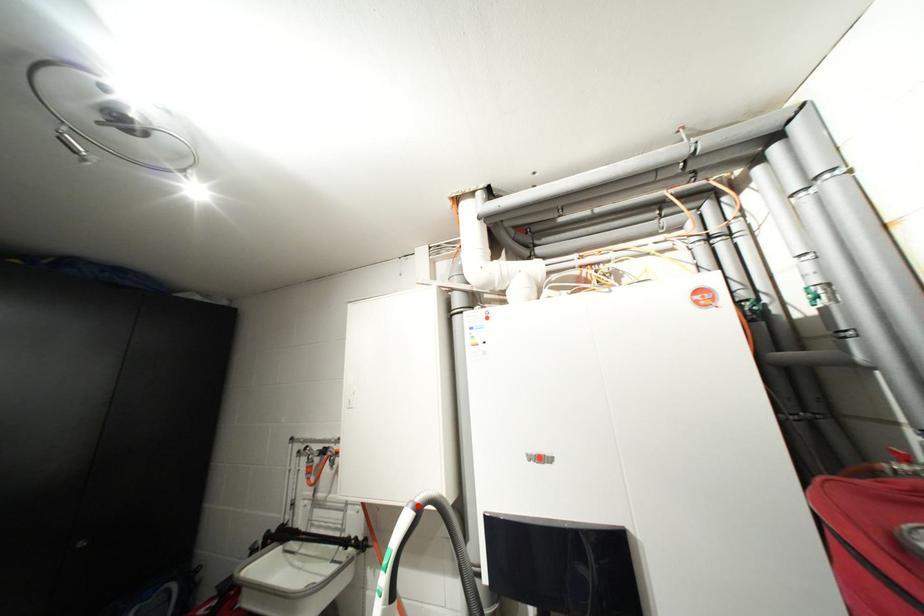
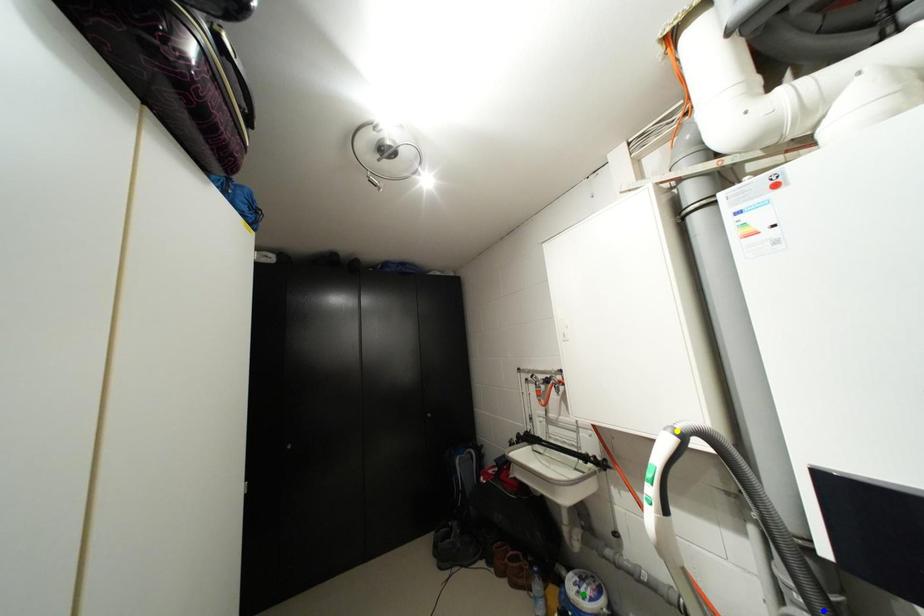
Question: I am providing you with two images of the same scene from different viewpoints. A red point is marked on the first image. You are given multiple points on the second image. In image 2, which mark is for the same physical point as the one in image 1?

Choices:
 (A) yellow point
 (B) green point
 (C) blue point

Answer: (A)